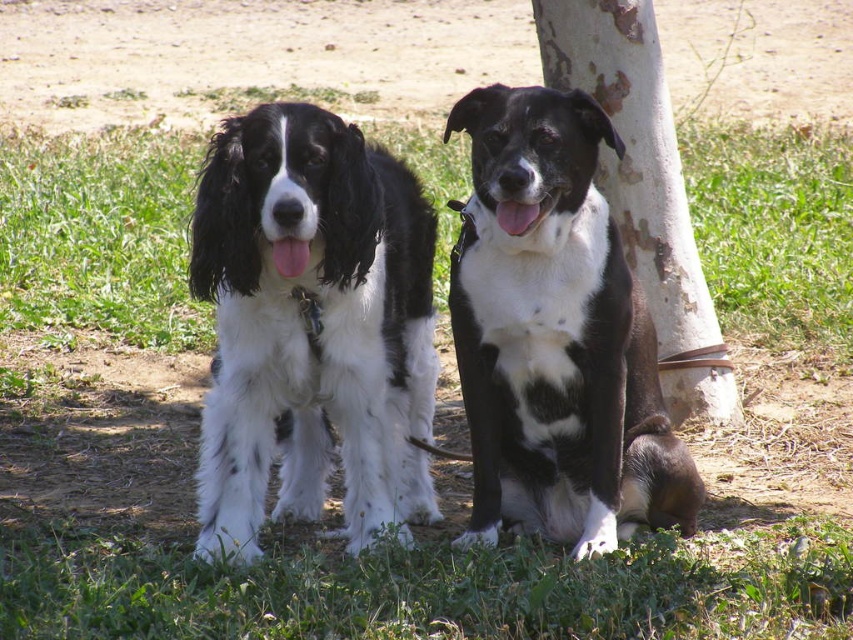
You are a gardener trying to plant a new flower bed. You notice the soft white fur at center and the green grass at lower center. Which area has more space between the strands for the roots to grow?

The soft white fur at center is thinner than green grass at lower center, so the soft white fur at center has more space between the strands for the roots to grow.